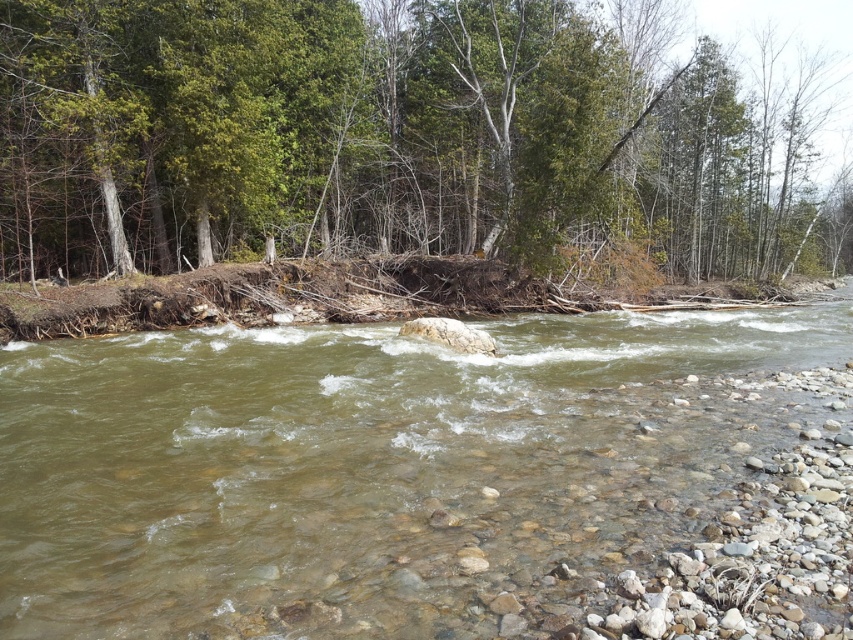
You are standing on the bank of the river and want to take a photo of both the green leafy tree at upper center and the white smooth rock at center. Which object should you position to your left side to include both in the frame?

To include both the green leafy tree at upper center and the white smooth rock at center in the frame, you should position the white smooth rock at center to your left side since the green leafy tree at upper center is located to the right of it.

In the scene shown: You are a geologist examining the riverbed. You notice two rocks at the center of the river. Which one is located to the right of the other? The clear sedimentary rock at center or the white smooth rock at center?

The clear sedimentary rock at center is positioned on the right side of white smooth rock at center.